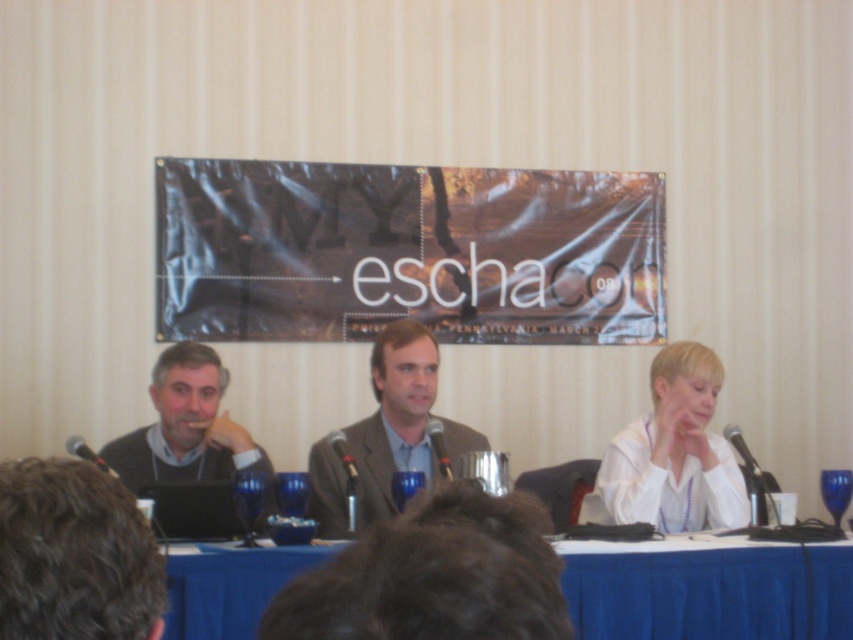
Who is more distant from viewer, (219, 486) or (93, 460)?

The point (93, 460) is behind.

At what (x,y) coordinates should I click in order to perform the action: click on dark gray sweater at left. Please return your answer as a coordinate pair (x, y). Looking at the image, I should click on (189, 445).

Does blue fabric table at center appear on the left side of white matte shirt at center?

Indeed, blue fabric table at center is positioned on the left side of white matte shirt at center.

Where is `blue fabric table at center`? blue fabric table at center is located at coordinates (706, 589).

Which is more to the right, matte gray suit at center or black metallic microphone at left?

matte gray suit at center is more to the right.

Between matte gray suit at center and black metallic microphone at left, which one has less height?

With less height is black metallic microphone at left.

Where is `matte gray suit at center`? matte gray suit at center is located at coordinates (393, 417).